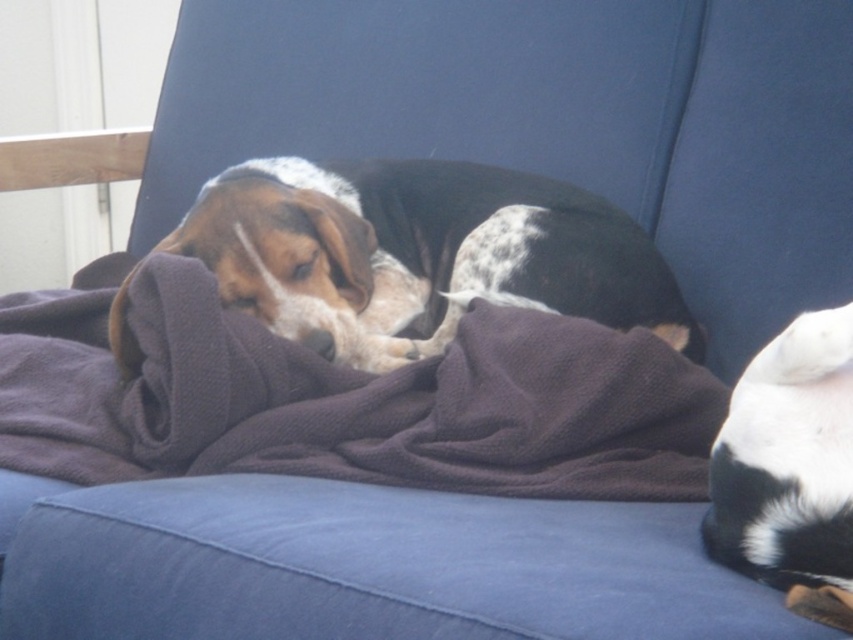
You are a pet sitter who needs to cover the brown and white fur dog at center with an extra blanket. Given that the brown cotton blanket at center is already under the dog, where should you place the new blanket relative to the dog?

You should place the new blanket above the brown and white fur dog at center since the existing brown cotton blanket at center is located below the dog, so placing the new one above would cover the dog effectively.

Please describe the object located at point (x=419, y=253) in the image.

The object at point (x=419, y=253) is a brown and white fur dog at center.

You are a delivery person who needs to place a small package on the couch without disturbing the dog. The couch has a blue fabric seat and backrest. Where should you place the package so it doesn not land on the brown cotton blanket at center?

The brown cotton blanket at center is located at point (345,397). To avoid placing the package on it, the delivery person should place the package in an area of the couch not overlapping with the coordinates of the brown cotton blanket at center.